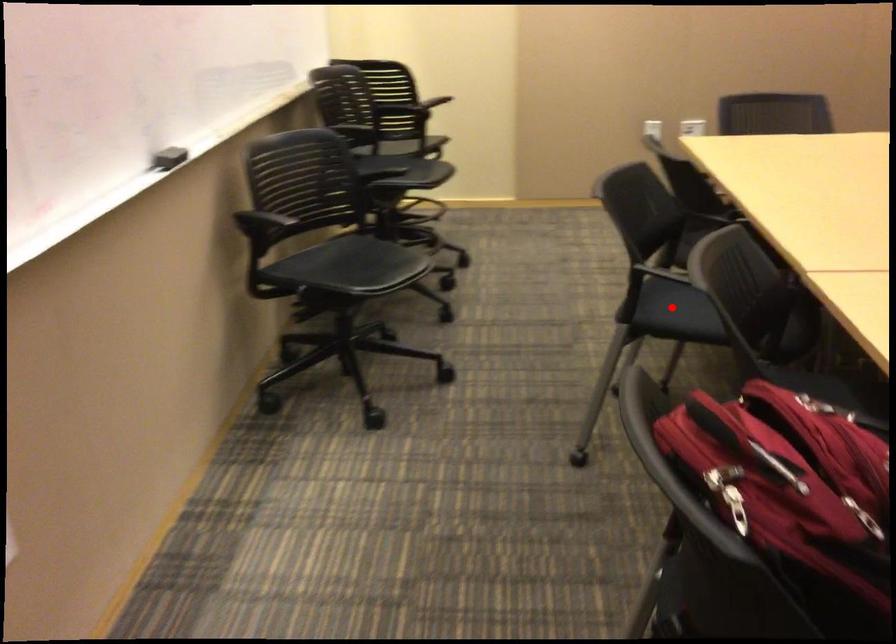
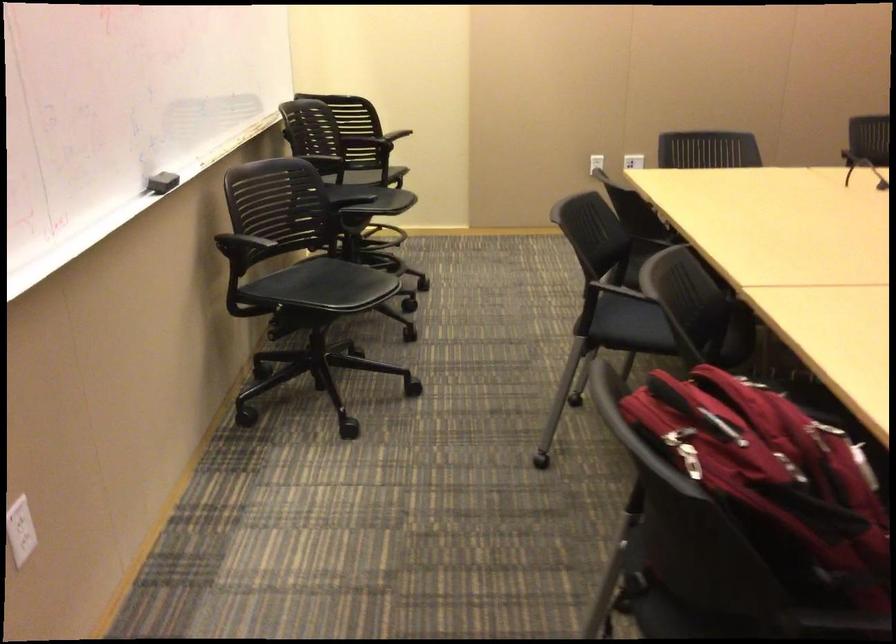
Question: I am providing you with two images of the same scene from different viewpoints. A red point is marked on the first image. Can you still see the location of the red point in image 2?

Choices:
 (A) Yes
 (B) No

Answer: (A)